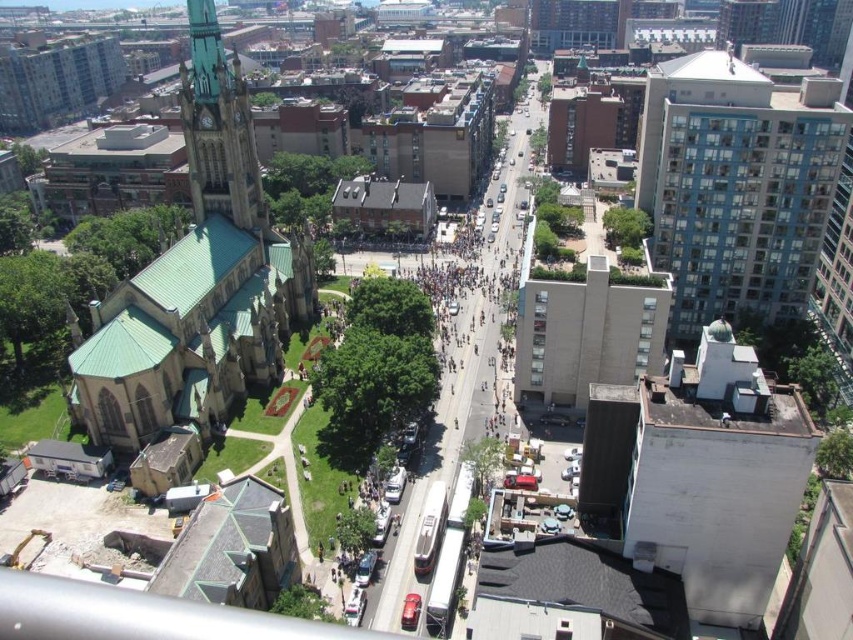
Question: Which point appears farthest from the camera in this image?

Choices:
 (A) (769, 104)
 (B) (276, 234)
 (C) (245, 93)

Answer: (B)

Question: Can you confirm if green stone church at left is wider than blue glass building at upper right?

Choices:
 (A) no
 (B) yes

Answer: (A)

Question: Considering the relative positions of green stone church at left and blue glass building at upper right in the image provided, where is green stone church at left located with respect to blue glass building at upper right?

Choices:
 (A) below
 (B) above

Answer: (A)

Question: Does green stone church at left have a greater width compared to blue glass building at upper right?

Choices:
 (A) yes
 (B) no

Answer: (B)

Question: Which point is closer to the camera taking this photo?

Choices:
 (A) (728, 100)
 (B) (258, 228)

Answer: (A)

Question: Which object is closer to the camera taking this photo?

Choices:
 (A) green copper tower at upper left
 (B) blue glass building at upper right

Answer: (B)